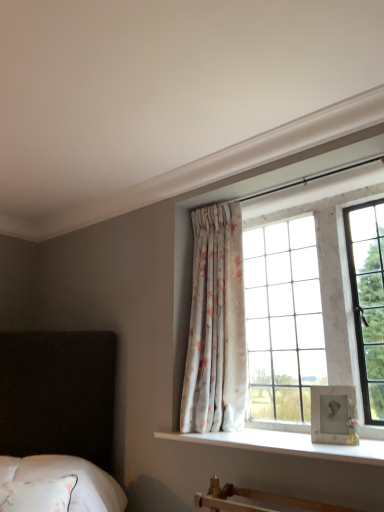
Find the location of a particular element. The width and height of the screenshot is (384, 512). free spot below floral fabric curtain at center (from a real-world perspective) is located at coordinates (212, 433).